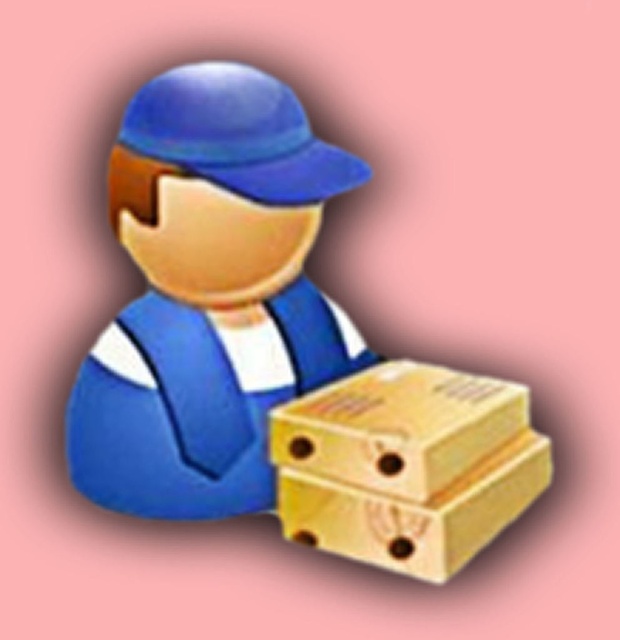
Question: Considering the real-world distances, which object is farthest from the yellow cardboard box at lower right?

Choices:
 (A) wooden box at center
 (B) matte blue uniform at center

Answer: (B)

Question: Which object is positioned closest to the yellow cardboard box at lower right?

Choices:
 (A) wooden box at center
 (B) matte blue uniform at center

Answer: (A)

Question: Does matte blue uniform at center come in front of yellow cardboard box at lower right?

Choices:
 (A) yes
 (B) no

Answer: (B)

Question: Does matte blue uniform at center appear under wooden box at center?

Choices:
 (A) yes
 (B) no

Answer: (B)

Question: Is yellow cardboard box at lower right thinner than wooden box at center?

Choices:
 (A) no
 (B) yes

Answer: (B)

Question: Which of these objects is positioned farthest from the wooden box at center?

Choices:
 (A) yellow cardboard box at lower right
 (B) matte blue uniform at center

Answer: (B)